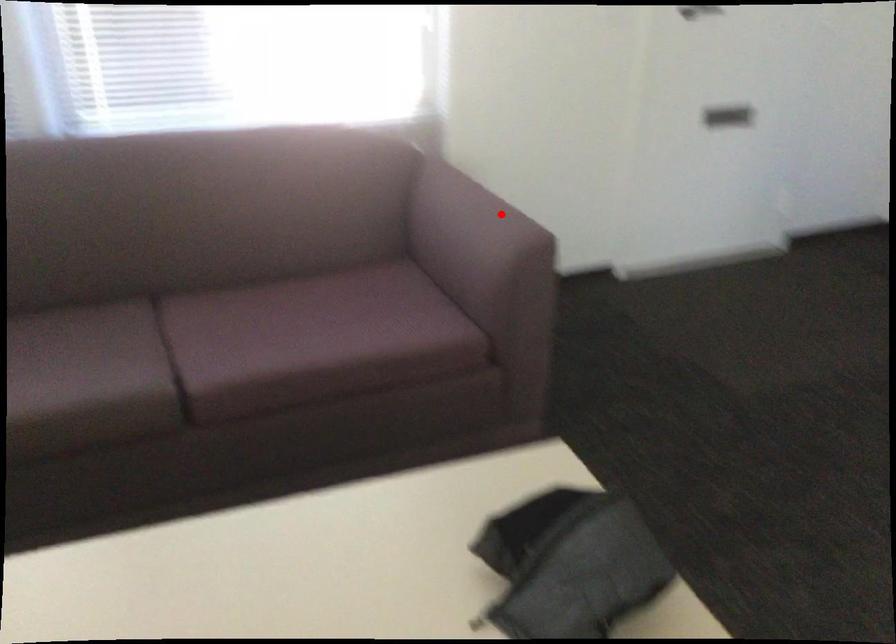
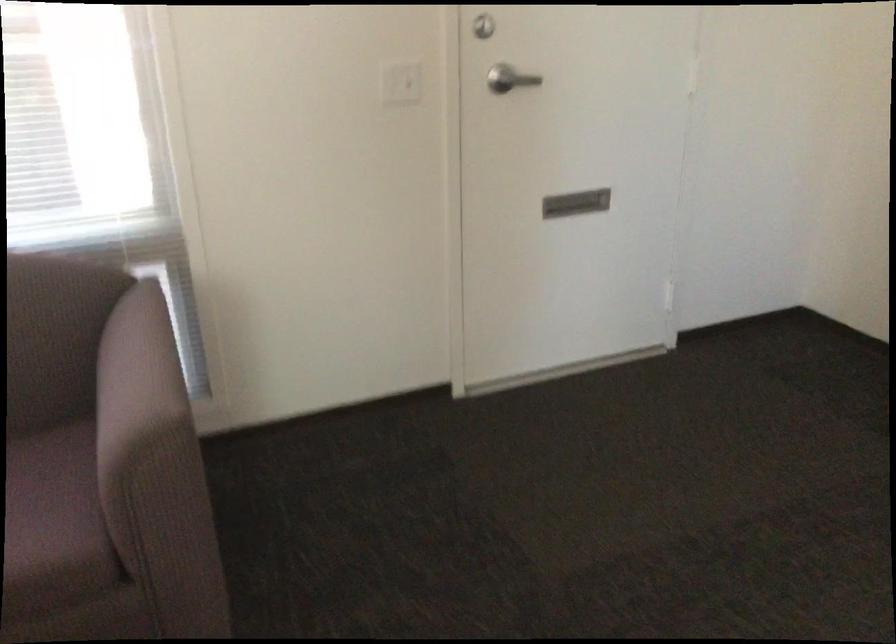
Locate, in the second image, the point that corresponds to the highlighted location in the first image.

(136, 381)